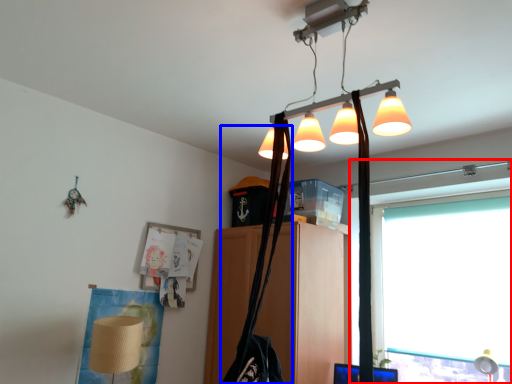
Question: Which object appears closest to the camera in this image, window (highlighted by a red box) or shoulder bag (highlighted by a blue box)?

Choices:
 (A) window
 (B) shoulder bag

Answer: (B)